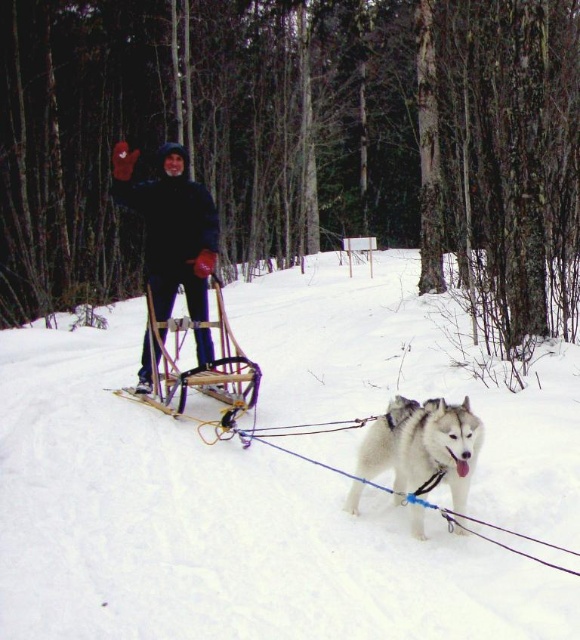
From the picture: You are a hiker who wants to take a photo of the black fabric jacket at center and the white fluffy snow at center. Which object is closer to the camera based on their positions in the scene?

The black fabric jacket at center is closer to the camera than the white fluffy snow at center because the jacket is taller than the snow.

You are a photographer trying to capture the perfect shot of the white fluffy snow at center and the white fur dog at center. Since both are white, you want to ensure that the dog is clearly visible in the photo. Based on the scene description, which object should you focus on to make sure the dog stands out?

The white fluffy snow at center is positioned over white fur dog at center, so focusing on the dog will make it stand out against the snow.

You are a photographer trying to capture a photo of the black fabric jacket at center and the white fur dog at center. Based on their positions, which one should you focus on first to ensure both are in the frame?

The black fabric jacket at center is located above the white fur dog at center, so you should focus on the white fur dog at center first to ensure both are in the frame.